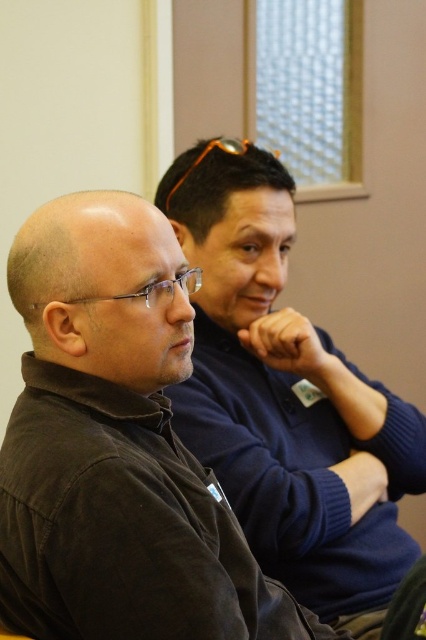
Is point (244, 627) behind point (340, 548)?

No, (244, 627) is in front of (340, 548).

Between point (181, 556) and point (276, 224), which one is positioned in front?

Point (181, 556) is in front.

Where is `black matte jacket at left`? Image resolution: width=426 pixels, height=640 pixels. black matte jacket at left is located at coordinates (117, 445).

Where is `black matte jacket at left`? black matte jacket at left is located at coordinates (117, 445).